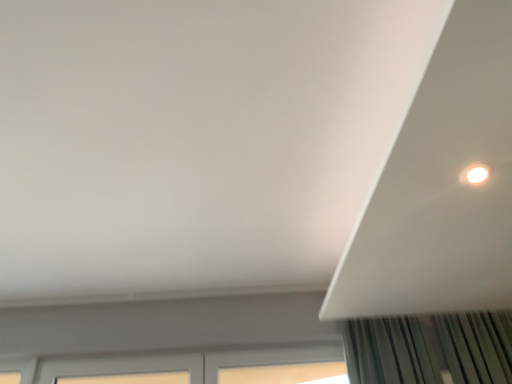
Question: Considering the positions of white wooden window at lower center and white matte exhaust hood at upper right in the image, is white wooden window at lower center bigger or smaller than white matte exhaust hood at upper right?

Choices:
 (A) big
 (B) small

Answer: (B)

Question: From a real-world perspective, is white wooden window at lower center positioned above or below white matte exhaust hood at upper right?

Choices:
 (A) below
 (B) above

Answer: (A)

Question: Considering the positions of white wooden window at lower center and white matte exhaust hood at upper right in the image, is white wooden window at lower center taller or shorter than white matte exhaust hood at upper right?

Choices:
 (A) tall
 (B) short

Answer: (A)

Question: Does point (460, 64) appear closer or farther from the camera than point (128, 380)?

Choices:
 (A) closer
 (B) farther

Answer: (A)

Question: Is white matte exhaust hood at upper right situated inside white wooden window at lower center or outside?

Choices:
 (A) outside
 (B) inside

Answer: (A)

Question: Is white matte exhaust hood at upper right taller or shorter than white wooden window at lower center?

Choices:
 (A) tall
 (B) short

Answer: (B)

Question: In terms of size, does white matte exhaust hood at upper right appear bigger or smaller than white wooden window at lower center?

Choices:
 (A) small
 (B) big

Answer: (B)